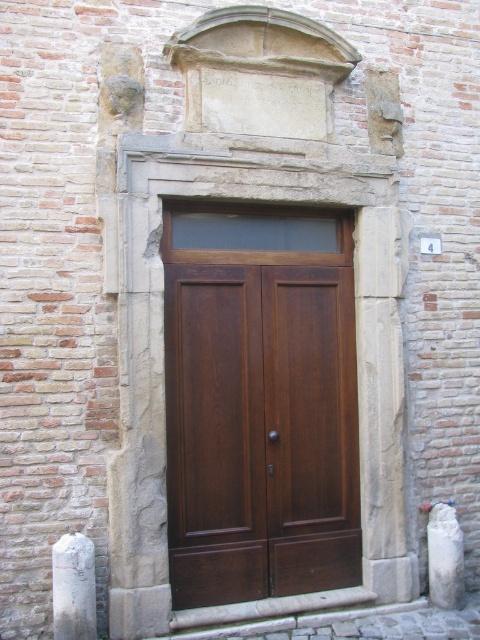
Question: Which of these objects is positioned closest to the dark wood door at center?

Choices:
 (A) white marble pillar at center
 (B) white stone pillar at lower left

Answer: (A)

Question: Does dark wood door at center have a larger size compared to white stone pillar at lower left?

Choices:
 (A) yes
 (B) no

Answer: (A)

Question: Which object is the farthest from the dark wood door at center?

Choices:
 (A) white stone pillar at lower left
 (B) white marble pillar at center

Answer: (A)

Question: Among these points, which one is farthest from the camera?

Choices:
 (A) (62, 628)
 (B) (442, 570)

Answer: (B)

Question: Does white stone pillar at lower left appear over white marble pillar at center?

Choices:
 (A) yes
 (B) no

Answer: (A)

Question: Does dark wood door at center appear over white marble pillar at center?

Choices:
 (A) yes
 (B) no

Answer: (A)